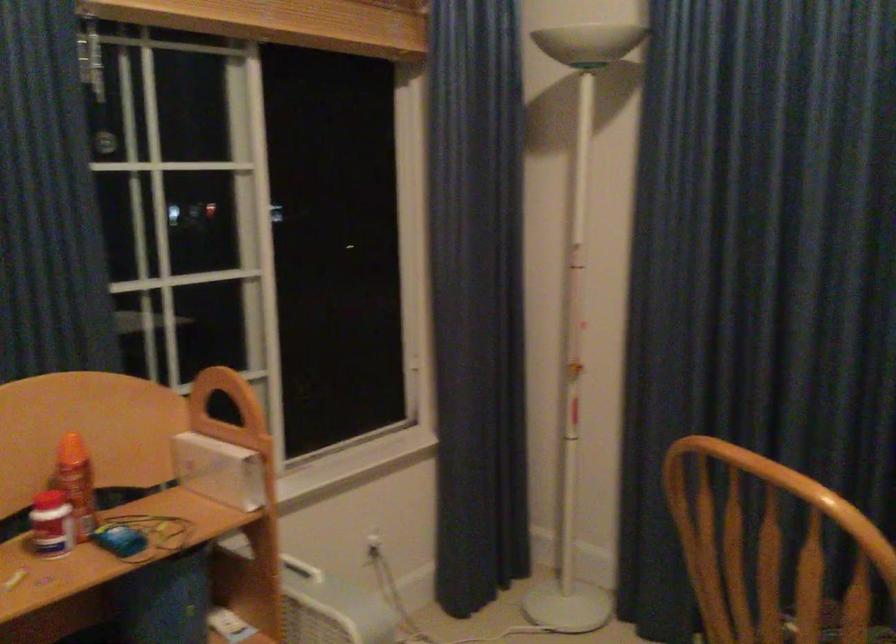
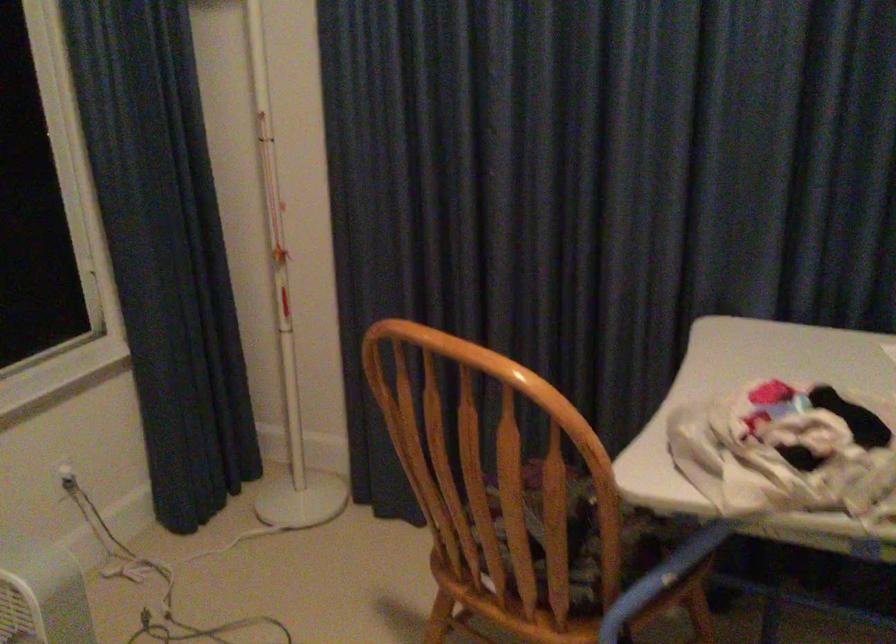
Question: Based on the continuous images, in which direction is the camera rotating? Reply with the corresponding letter.

Choices:
 (A) Left
 (B) Right
 (C) Up
 (D) Down

Answer: (B)